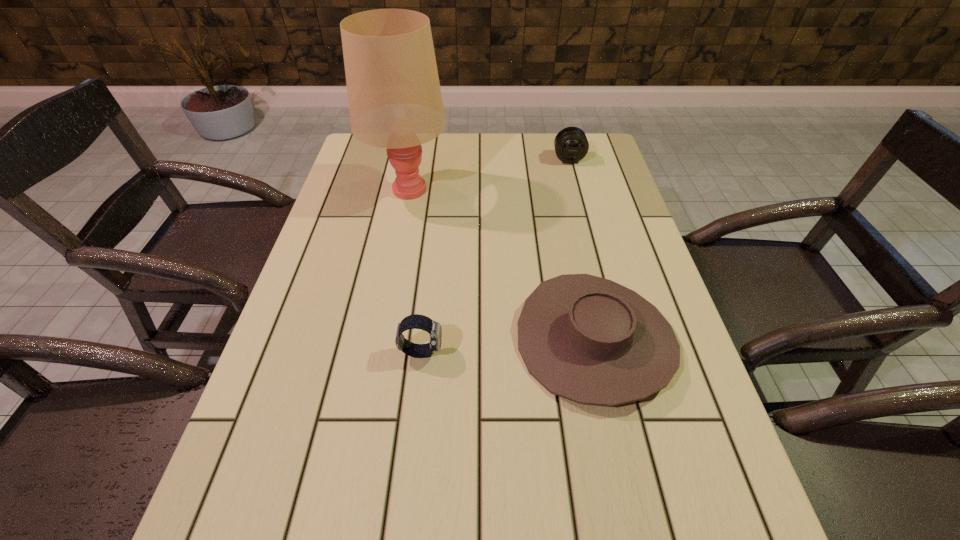
Locate an element on the screen. empty space between the farthest object and the tallest object is located at coordinates (489, 174).

You are a GUI agent. You are given a task and a screenshot of the screen. Output one action in this format:
    pyautogui.click(x=<x>, y=<y>)
    Task: Click on the empty location between the tallest object and the cowboy hat
    The width and height of the screenshot is (960, 540).
    Given the screenshot: What is the action you would take?
    pyautogui.click(x=501, y=265)

Find the location of a particular element. vacant space in between the cowboy hat and the lampshade is located at coordinates (501, 265).

Identify the location of free space that is in between the third nearest object and the watch. (415, 271).

Locate an element on the screen. This screenshot has height=540, width=960. empty space that is in between the cowboy hat and the tallest object is located at coordinates (501, 265).

Locate an element on the screen. vacant area between the telephoto lens and the watch is located at coordinates (494, 255).

This screenshot has width=960, height=540. In order to click on vacant space that's between the watch and the telephoto lens in this screenshot , I will do `click(494, 255)`.

Find the location of a particular element. The width and height of the screenshot is (960, 540). empty location between the tallest object and the shortest object is located at coordinates (501, 265).

Locate an element on the screen. The height and width of the screenshot is (540, 960). free space between the telephoto lens and the tallest object is located at coordinates (489, 174).

You are a GUI agent. You are given a task and a screenshot of the screen. Output one action in this format:
    pyautogui.click(x=<x>, y=<y>)
    Task: Click on the free space that is in between the tallest object and the farthest object
    
    Given the screenshot: What is the action you would take?
    pyautogui.click(x=489, y=174)